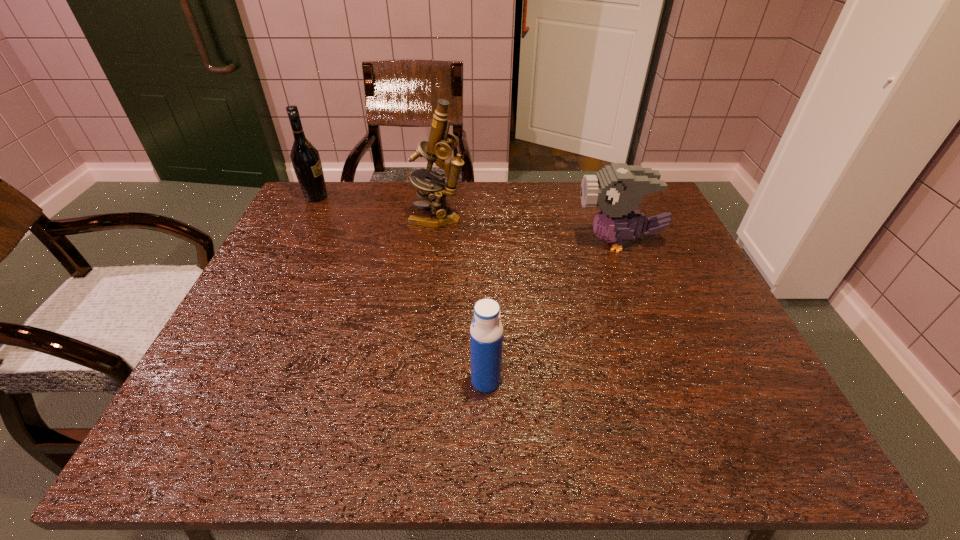
The image size is (960, 540). What are the coordinates of `vacant space situated at the beak of the bird` in the screenshot? It's located at (466, 242).

The image size is (960, 540). Find the location of `vacant point located 0.140m at the beak of the bird`. vacant point located 0.140m at the beak of the bird is located at coordinates (524, 242).

Where is `free region located at the beak of the bird`? This screenshot has height=540, width=960. free region located at the beak of the bird is located at coordinates [557, 242].

At what (x,y) coordinates should I click in order to perform the action: click on vacant space situated on the left of the second object from right to left. Please return your answer as a coordinate pair (x, y). Looking at the image, I should click on (426, 381).

The height and width of the screenshot is (540, 960). Find the location of `microscope that is at the far edge`. microscope that is at the far edge is located at coordinates (441, 143).

At what (x,y) coordinates should I click in order to perform the action: click on wine bottle present at the far edge. Please return your answer as a coordinate pair (x, y). This screenshot has height=540, width=960. Looking at the image, I should click on (305, 158).

Where is `object situated at the left edge`? object situated at the left edge is located at coordinates (305, 158).

Locate an element on the screen. The height and width of the screenshot is (540, 960). object that is at the right edge is located at coordinates (617, 189).

The width and height of the screenshot is (960, 540). What are the coordinates of `object that is at the far left corner` in the screenshot? It's located at (305, 158).

Locate an element on the screen. The height and width of the screenshot is (540, 960). vacant area at the far edge of the desktop is located at coordinates (379, 184).